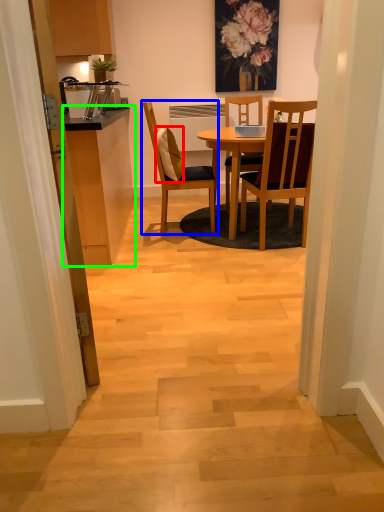
Question: Estimate the real-world distances between objects in this image. Which object is closer to pillow (highlighted by a red box), chair (highlighted by a blue box) or cabinetry (highlighted by a green box)?

Choices:
 (A) chair
 (B) cabinetry

Answer: (A)